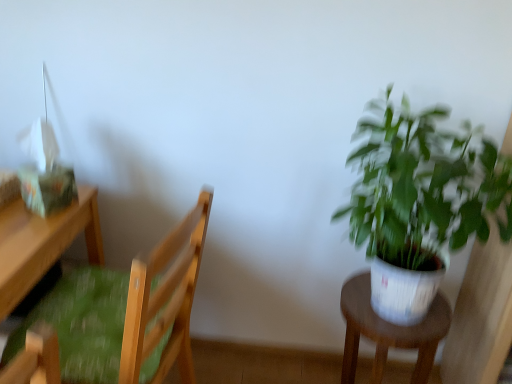
Question: From the image's perspective, is wooden desk at left beneath green leafy plant at right?

Choices:
 (A) no
 (B) yes

Answer: (B)

Question: From the image's perspective, is wooden desk at left located above green leafy plant at right?

Choices:
 (A) no
 (B) yes

Answer: (A)

Question: Is the depth of wooden desk at left less than that of green leafy plant at right?

Choices:
 (A) yes
 (B) no

Answer: (B)

Question: From a real-world perspective, is wooden desk at left positioned over green leafy plant at right based on gravity?

Choices:
 (A) yes
 (B) no

Answer: (B)

Question: Is wooden desk at left to the left of green leafy plant at right from the viewer's perspective?

Choices:
 (A) no
 (B) yes

Answer: (B)

Question: Choose the correct answer: Is green leafy plant at right inside white plastic stool at right or outside it?

Choices:
 (A) outside
 (B) inside

Answer: (A)

Question: Considering their positions, is green leafy plant at right located in front of or behind white plastic stool at right?

Choices:
 (A) behind
 (B) front

Answer: (B)

Question: Is green leafy plant at right bigger or smaller than white plastic stool at right?

Choices:
 (A) big
 (B) small

Answer: (A)

Question: Is green leafy plant at right to the left or to the right of white plastic stool at right in the image?

Choices:
 (A) left
 (B) right

Answer: (B)

Question: Is wooden desk at left bigger or smaller than wooden chair with green cushion at left?

Choices:
 (A) small
 (B) big

Answer: (B)

Question: In terms of height, does wooden desk at left look taller or shorter compared to wooden chair with green cushion at left?

Choices:
 (A) tall
 (B) short

Answer: (B)

Question: Is wooden desk at left inside or outside of wooden chair with green cushion at left?

Choices:
 (A) outside
 (B) inside

Answer: (A)

Question: Is point (53, 259) positioned closer to the camera than point (210, 195)?

Choices:
 (A) farther
 (B) closer

Answer: (A)

Question: Considering the positions of white plastic stool at right and wooden chair with green cushion at left in the image, is white plastic stool at right taller or shorter than wooden chair with green cushion at left?

Choices:
 (A) tall
 (B) short

Answer: (B)

Question: Considering the positions of white plastic stool at right and wooden chair with green cushion at left in the image, is white plastic stool at right bigger or smaller than wooden chair with green cushion at left?

Choices:
 (A) big
 (B) small

Answer: (B)